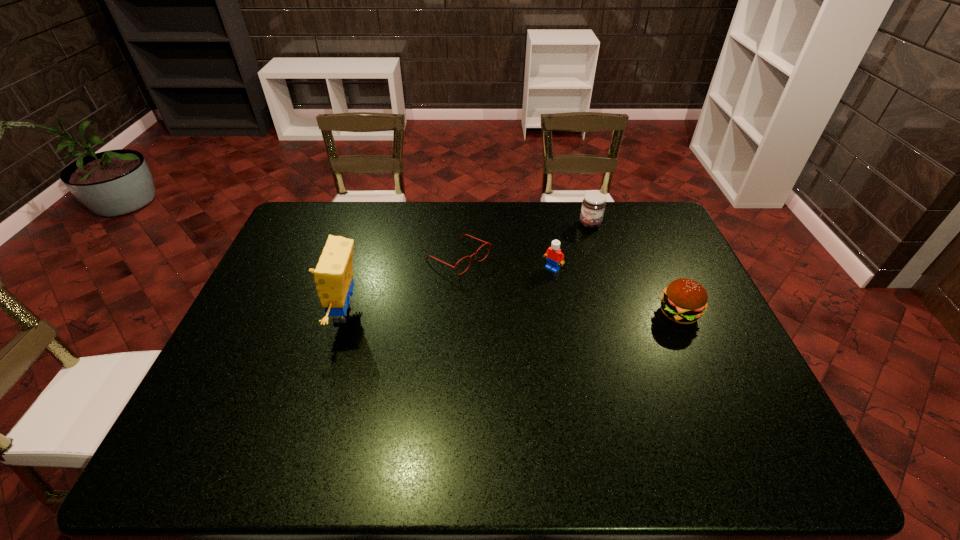
You are a GUI agent. You are given a task and a screenshot of the screen. Output one action in this format:
    pyautogui.click(x=<x>, y=<y>)
    Task: Click on the vacant region between the leftmost object and the fourth object from left to right
    This screenshot has width=960, height=540.
    Given the screenshot: What is the action you would take?
    pyautogui.click(x=467, y=269)

The height and width of the screenshot is (540, 960). I want to click on free spot between the farthest object and the sponge, so click(467, 269).

Where is `free space between the leftmost object and the fourth object from right to left`? Image resolution: width=960 pixels, height=540 pixels. free space between the leftmost object and the fourth object from right to left is located at coordinates (401, 286).

Image resolution: width=960 pixels, height=540 pixels. What are the coordinates of `free space between the hamburger and the tallest object` in the screenshot? It's located at (511, 314).

This screenshot has width=960, height=540. Identify the location of unoccupied position between the third object from left to right and the second object from right to left. (571, 246).

I want to click on vacant area that lies between the hamburger and the sponge, so click(x=511, y=314).

I want to click on empty space between the sponge and the jam, so click(467, 269).

The image size is (960, 540). In order to click on empty location between the sponge and the fourth object from right to left in this screenshot , I will do `click(401, 286)`.

Where is `object that ranks as the third closest to the farthest object`? The image size is (960, 540). object that ranks as the third closest to the farthest object is located at coordinates (684, 301).

Identify the location of object that can be found as the closest to the third object from left to right. The height and width of the screenshot is (540, 960). (489, 244).